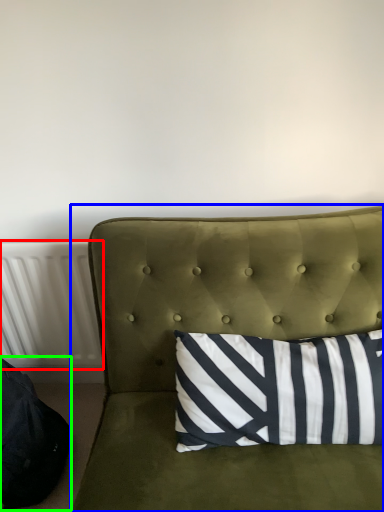
Question: Which object is positioned farthest from radiator (highlighted by a red box)? Select from studio couch (highlighted by a blue box) and bean bag chair (highlighted by a green box).

Choices:
 (A) studio couch
 (B) bean bag chair

Answer: (A)